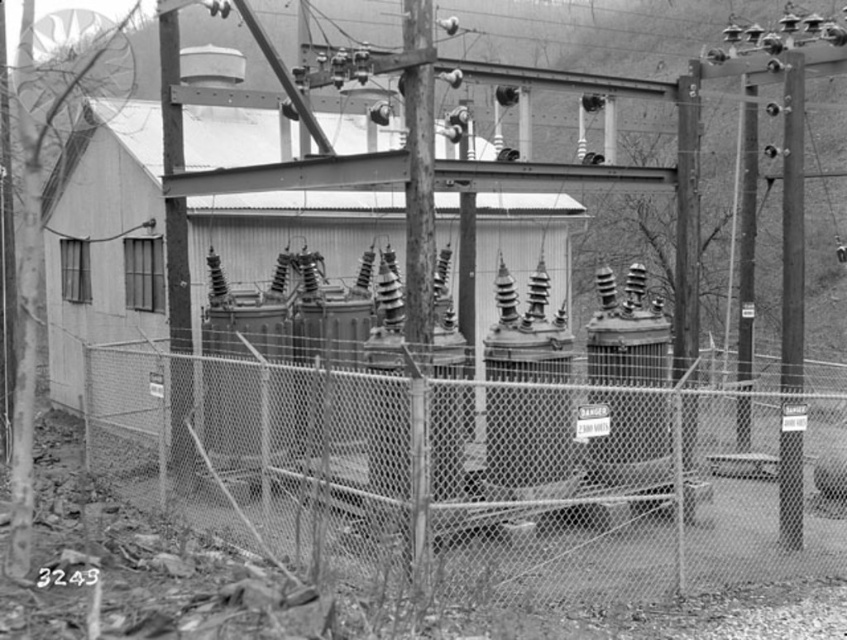
Who is positioned more to the left, chain link fence at center or smooth metal pole at upper left?

smooth metal pole at upper left is more to the left.

Who is lower down, chain link fence at center or smooth metal pole at upper left?

chain link fence at center

Between point (568, 426) and point (170, 67), which one is positioned behind?

Positioned behind is point (170, 67).

Find the location of `chain link fence at center`. chain link fence at center is located at coordinates (x=609, y=492).

Between chain link fence at center and metallic gray pole at right, which one has more height?

Standing taller between the two is metallic gray pole at right.

Does point (829, 524) come in front of point (789, 232)?

No, it is behind (789, 232).

What are the coordinates of `chain link fence at center` in the screenshot? It's located at (609, 492).

Between chain link fence at center and metallic pole at right, which one appears on the right side from the viewer's perspective?

metallic pole at right

Between chain link fence at center and metallic pole at right, which one appears on the left side from the viewer's perspective?

From the viewer's perspective, chain link fence at center appears more on the left side.

Which is behind, point (253, 355) or point (751, 298)?

The point (751, 298) is behind.

This screenshot has width=847, height=640. Identify the location of chain link fence at center. click(x=609, y=492).